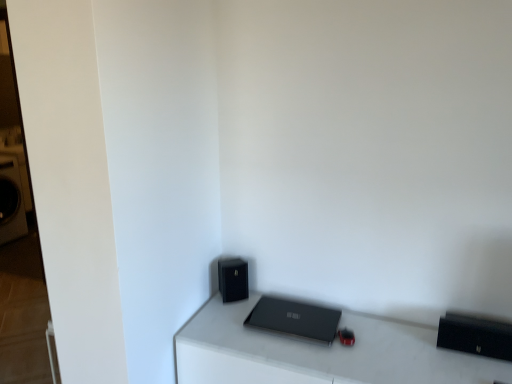
Image resolution: width=512 pixels, height=384 pixels. Find the location of `free area in between black matte speaker at lower center and matte black laptop at center`. free area in between black matte speaker at lower center and matte black laptop at center is located at coordinates (249, 311).